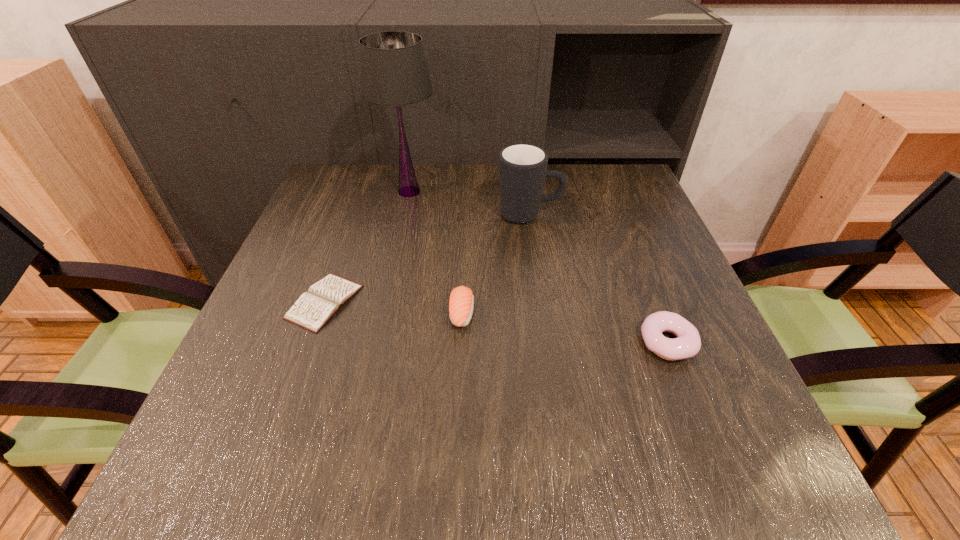
You are a GUI agent. You are given a task and a screenshot of the screen. Output one action in this format:
    pyautogui.click(x=<x>, y=<y>)
    Task: Click on the vacant space in between the diary and the fourth shortest object
    The image size is (960, 540).
    Given the screenshot: What is the action you would take?
    pyautogui.click(x=427, y=258)

The width and height of the screenshot is (960, 540). What are the coordinates of `empty space that is in between the lampshade and the fourth object from left to right` in the screenshot? It's located at (469, 203).

Find the location of a particular element. This screenshot has width=960, height=540. free spot between the diary and the third tallest object is located at coordinates (394, 307).

What are the coordinates of `object that is the closest to the shortest object` in the screenshot? It's located at (x=461, y=301).

The width and height of the screenshot is (960, 540). I want to click on the closest object relative to the second shortest object, so click(461, 301).

This screenshot has height=540, width=960. In order to click on free location that satisfies the following two spatial constraints: 1. on the back side of the doughnut; 2. on the side of the mug with the handle in this screenshot , I will do `click(617, 214)`.

Locate an element on the screen. Image resolution: width=960 pixels, height=540 pixels. free spot that satisfies the following two spatial constraints: 1. on the front-facing side of the rightmost object; 2. on the right side of the lampshade is located at coordinates (376, 342).

Locate an element on the screen. This screenshot has width=960, height=540. vacant region that satisfies the following two spatial constraints: 1. on the front-facing side of the third object from left to right; 2. on the right side of the tallest object is located at coordinates pyautogui.click(x=383, y=313).

Where is `free space that satisfies the following two spatial constraints: 1. on the front side of the sushi; 2. on the left side of the shortest object`? Image resolution: width=960 pixels, height=540 pixels. free space that satisfies the following two spatial constraints: 1. on the front side of the sushi; 2. on the left side of the shortest object is located at coordinates (321, 313).